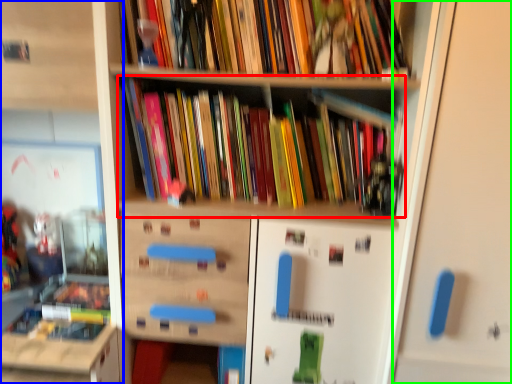
Question: Estimate the real-world distances between objects in this image. Which object is closer to book (highlighted by a red box), shelf (highlighted by a blue box) or door (highlighted by a green box)?

Choices:
 (A) shelf
 (B) door

Answer: (B)